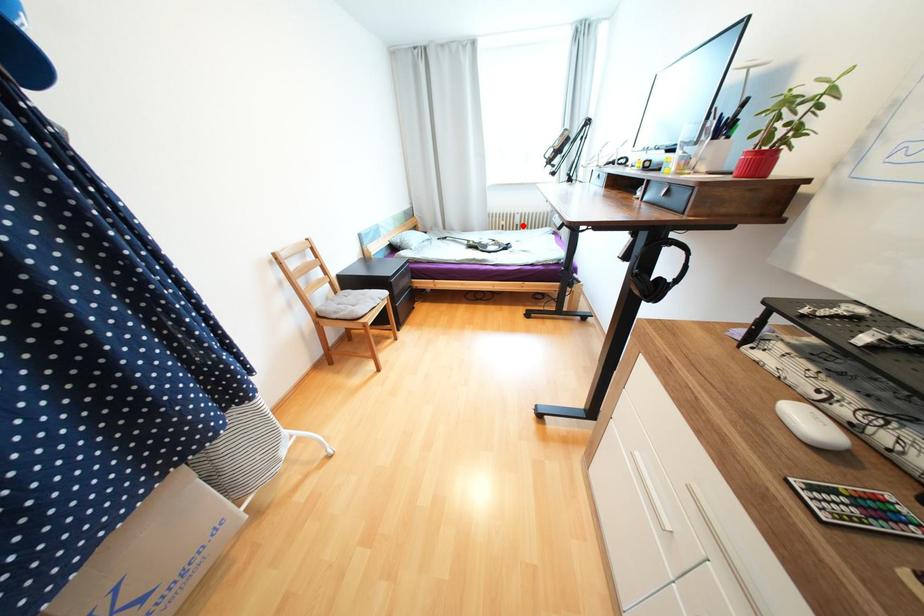
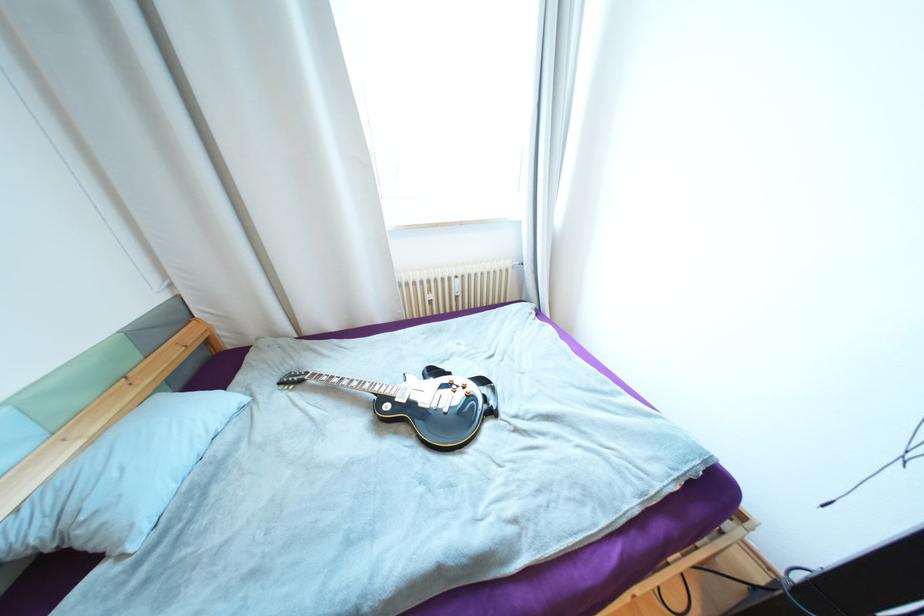
Find the pixel in the second image that matches the highlighted location in the first image.

(463, 297)